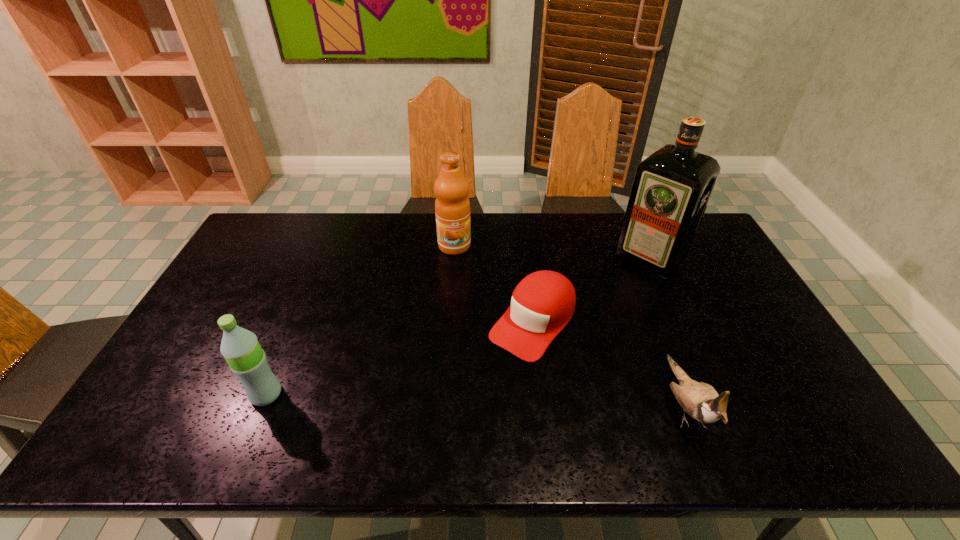
Where is `water bottle located at the near edge`? The image size is (960, 540). water bottle located at the near edge is located at coordinates (247, 360).

Find the location of `bird located at the near edge`. bird located at the near edge is located at coordinates (700, 400).

Image resolution: width=960 pixels, height=540 pixels. Identify the location of object that is at the right edge. (671, 189).

Identify the location of object present at the far right corner. This screenshot has height=540, width=960. (671, 189).

In the image, there is a desktop. Where is `vacant space at the far edge`? vacant space at the far edge is located at coordinates (573, 219).

In the image, there is a desktop. Where is `vacant space at the near edge`? vacant space at the near edge is located at coordinates (626, 395).

Find the location of a particular element. blank area at the left edge is located at coordinates (236, 285).

You are a GUI agent. You are given a task and a screenshot of the screen. Output one action in this format:
    pyautogui.click(x=<x>, y=<y>)
    Task: Click on the free space at the far right corner of the desktop
    
    Given the screenshot: What is the action you would take?
    pyautogui.click(x=698, y=244)

Locate an element on the screen. vacant space that is in between the baseball cap and the liquor is located at coordinates (591, 290).

You are a GUI agent. You are given a task and a screenshot of the screen. Output one action in this format:
    pyautogui.click(x=<x>, y=<y>)
    Task: Click on the free space between the fruit juice and the second shortest object
    This screenshot has width=960, height=540.
    Given the screenshot: What is the action you would take?
    pyautogui.click(x=569, y=324)